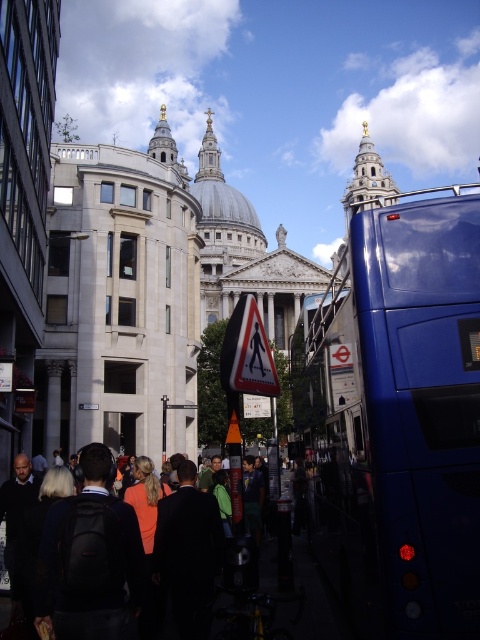
Question: Does blue metallic bus at right come in front of black matte backpack at lower left?

Choices:
 (A) yes
 (B) no

Answer: (A)

Question: Estimate the real-world distances between objects in this image. Which object is closer to the dark gray fabric crowd at lower left?

Choices:
 (A) black matte backpack at lower left
 (B) white plastic pedestrian sign at center
 (C) blue metallic bus at right

Answer: (A)

Question: Can you confirm if blue metallic bus at right is wider than white plastic pedestrian sign at center?

Choices:
 (A) no
 (B) yes

Answer: (B)

Question: Observing the image, what is the correct spatial positioning of dark gray fabric crowd at lower left in reference to white plastic pedestrian sign at center?

Choices:
 (A) left
 (B) right

Answer: (A)

Question: Which of these objects is positioned closest to the white plastic pedestrian sign at center?

Choices:
 (A) black matte backpack at lower left
 (B) dark gray fabric crowd at lower left

Answer: (B)

Question: Among these points, which one is nearest to the camera?

Choices:
 (A) (233, 372)
 (B) (33, 573)

Answer: (B)